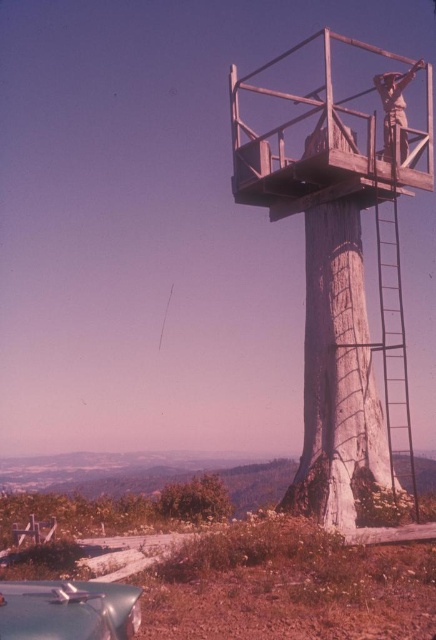
Is weathered wood tree trunk at center smaller than rusty metal figure at upper right?

Incorrect, weathered wood tree trunk at center is not smaller in size than rusty metal figure at upper right.

Which is in front, point (381, 458) or point (392, 83)?

Point (381, 458)

The image size is (436, 640). In order to click on weathered wood tree trunk at center in this screenshot , I will do `click(337, 378)`.

Who is positioned more to the left, wooden platform at upper center or green leafy tree at lower left?

From the viewer's perspective, green leafy tree at lower left appears more on the left side.

Is wooden platform at upper center positioned before green leafy tree at lower left?

That is True.

At what (x,y) coordinates should I click in order to perform the action: click on wooden platform at upper center. Please return your answer as a coordinate pair (x, y). Looking at the image, I should click on (340, 273).

Is point (394, 292) positioned after point (405, 76)?

No, it is not.

Which is behind, point (309, 374) or point (402, 120)?

Positioned behind is point (402, 120).

Locate an element on the screen. Image resolution: width=436 pixels, height=640 pixels. wooden platform at upper center is located at coordinates tap(340, 273).